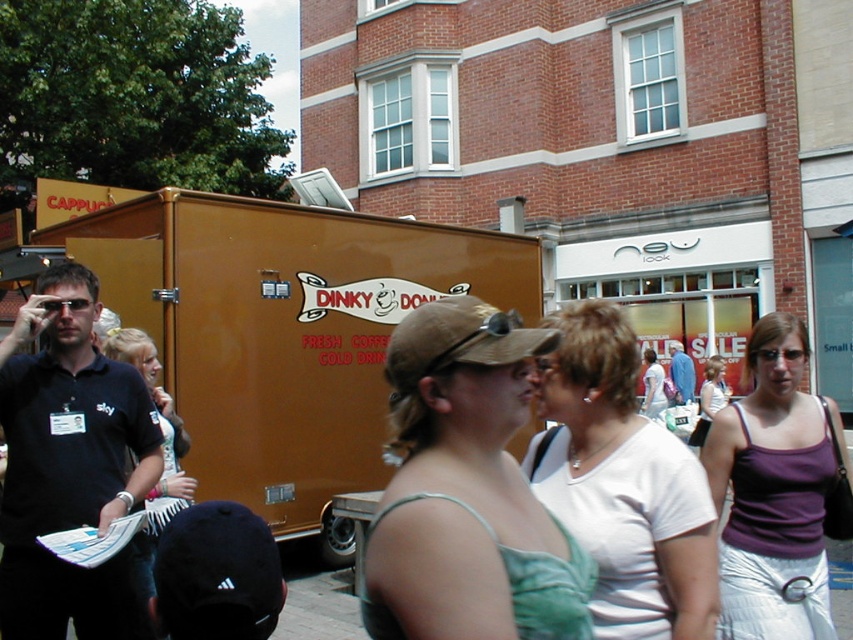
What do you see at coordinates (622, 484) in the screenshot? Image resolution: width=853 pixels, height=640 pixels. I see `white cotton shirt at center` at bounding box center [622, 484].

Which is more to the left, white cotton shirt at center or purple fabric tank top at center-right?

Positioned to the left is white cotton shirt at center.

Who is more distant from viewer, (583, 492) or (737, 477)?

The point (737, 477) is behind.

Where is `white cotton shirt at center`? The height and width of the screenshot is (640, 853). white cotton shirt at center is located at coordinates (622, 484).

Who is more forward, (405, 547) or (677, 602)?

Positioned in front is point (405, 547).

Is point (438, 394) positioned before point (621, 333)?

Yes, it is.

Locate an element on the screen. green fabric tank top at center is located at coordinates [x=466, y=492].

Can you confirm if gold metallic food truck at center is smaller than white cotton shirt at center?

Actually, gold metallic food truck at center might be larger than white cotton shirt at center.

Between gold metallic food truck at center and white cotton shirt at center, which one appears on the left side from the viewer's perspective?

Positioned to the left is gold metallic food truck at center.

Is point (379, 323) positioned before point (537, 381)?

No, it is not.

You are a GUI agent. You are given a task and a screenshot of the screen. Output one action in this format:
    pyautogui.click(x=<x>, y=<y>)
    Task: Click on the gold metallic food truck at center
    
    Given the screenshot: What is the action you would take?
    283,332